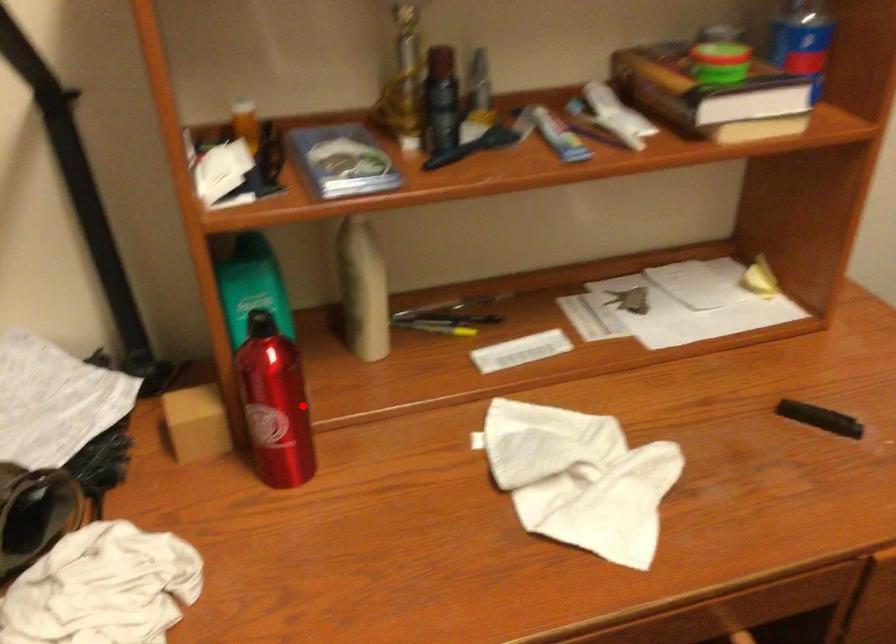
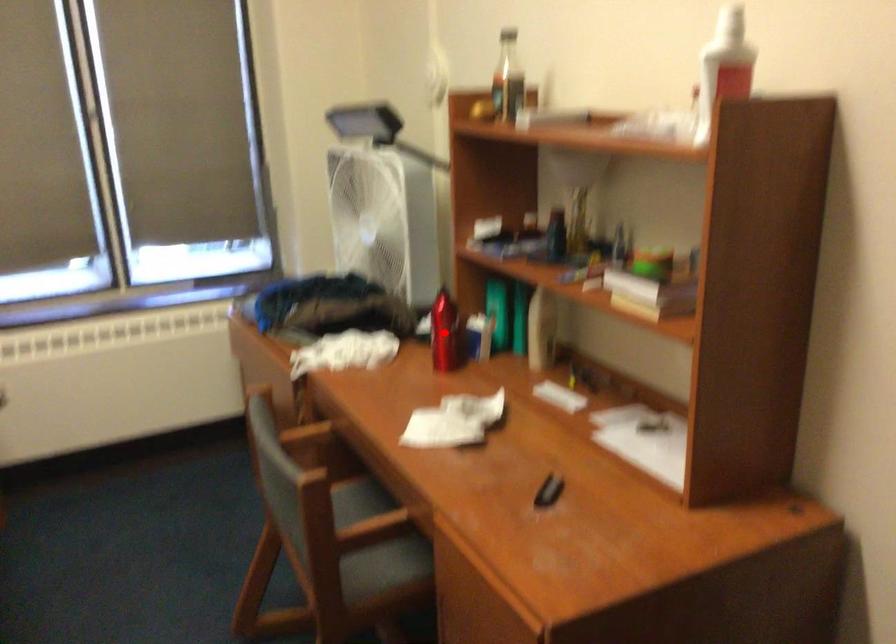
I am providing you with two images of the same scene from different viewpoints. A red point is marked on the first image and another point is marked on the second image. Do the highlighted points in image1 and image2 indicate the same real-world spot?

Yes